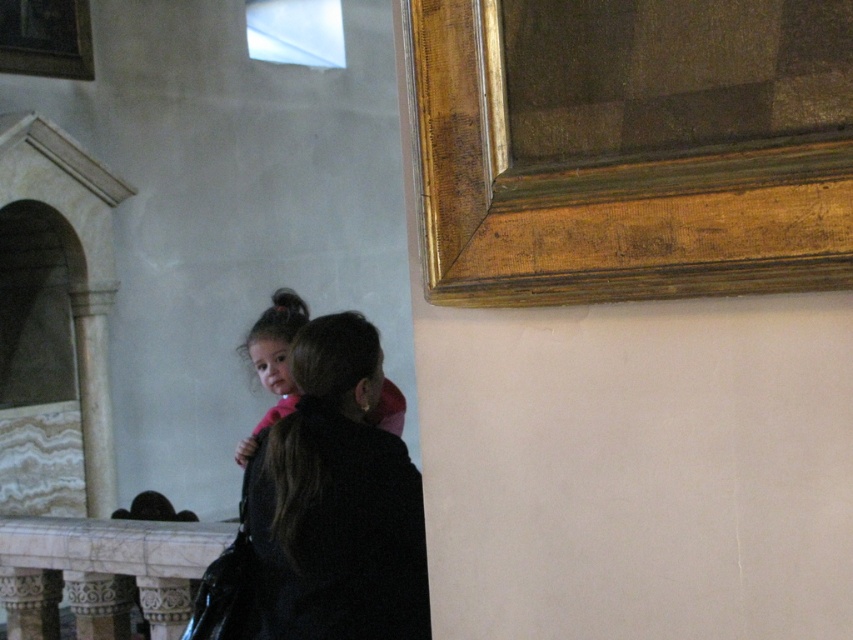
Question: Which of the following is the closest to the observer?

Choices:
 (A) gold textured frame at upper left
 (B) black matte jacket at center

Answer: (B)

Question: Which object is the farthest from the gold wood picture frame at upper right?

Choices:
 (A) gold textured frame at upper left
 (B) black matte jacket at center

Answer: (A)

Question: Which point is farther to the camera?

Choices:
 (A) (64, 524)
 (B) (296, 444)
 (C) (85, 10)
 (D) (607, 193)

Answer: (C)

Question: In this image, where is black matte jacket at center located relative to gold textured frame at upper left?

Choices:
 (A) below
 (B) above

Answer: (A)

Question: Observing the image, what is the correct spatial positioning of black matte jacket at center in reference to gold textured frame at upper left?

Choices:
 (A) left
 (B) right

Answer: (B)

Question: Is white marble balustrade at lower left wider than pink fabric at center?

Choices:
 (A) no
 (B) yes

Answer: (B)